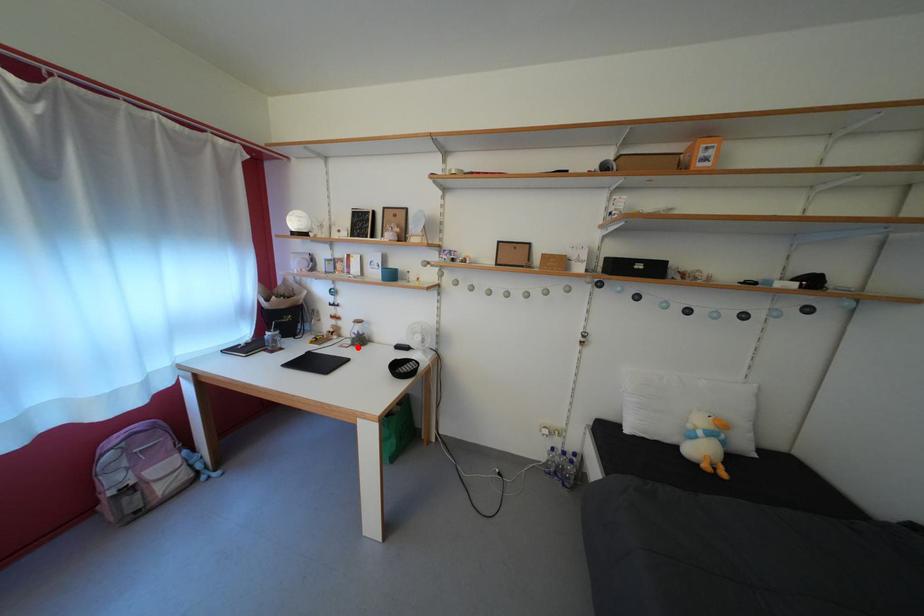
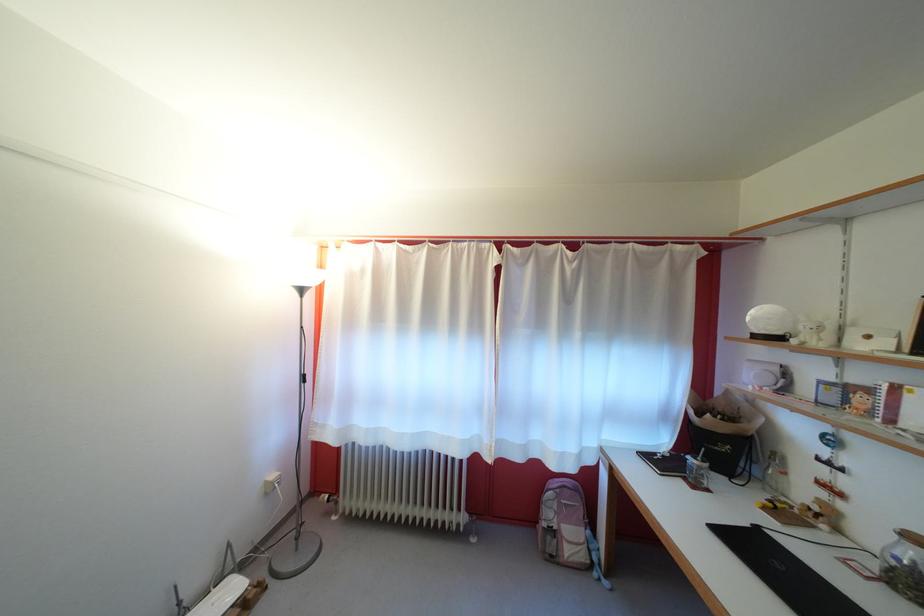
Locate, in the second image, the point that corresponds to the highlighted location in the first image.

(881, 570)